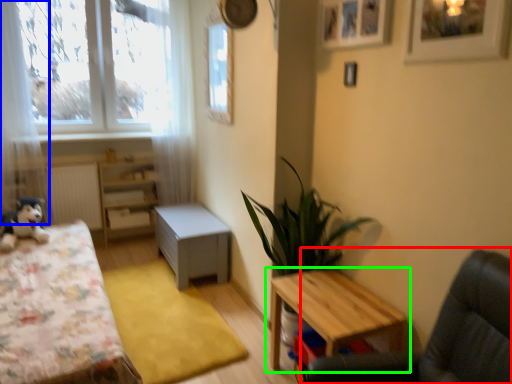
Question: Which object is positioned farthest from swivel chair (highlighted by a red box)? Select from curtain (highlighted by a blue box) and table (highlighted by a green box).

Choices:
 (A) curtain
 (B) table

Answer: (A)